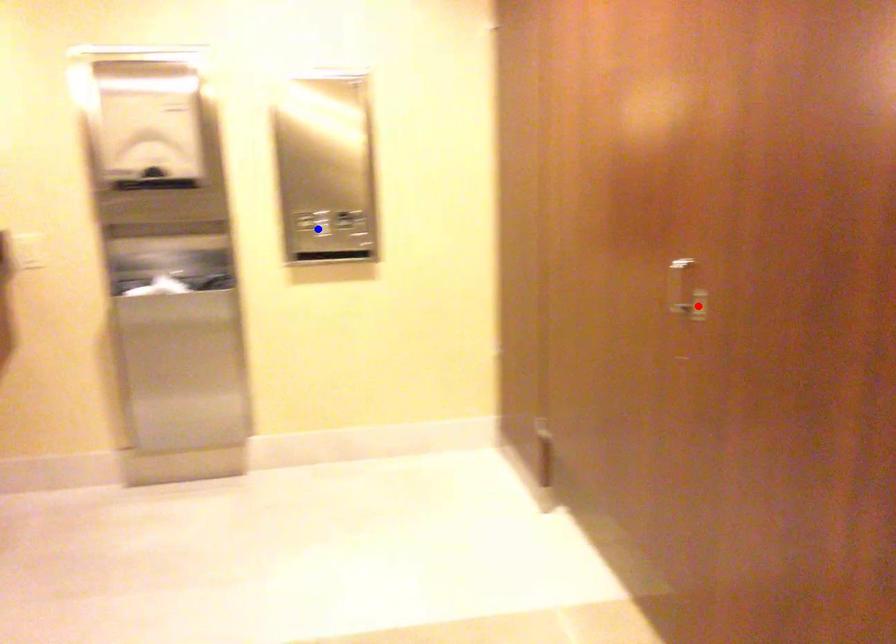
Question: Two points are marked on the image. Which point is closer to the camera?

Choices:
 (A) Blue point is closer.
 (B) Red point is closer.

Answer: (B)